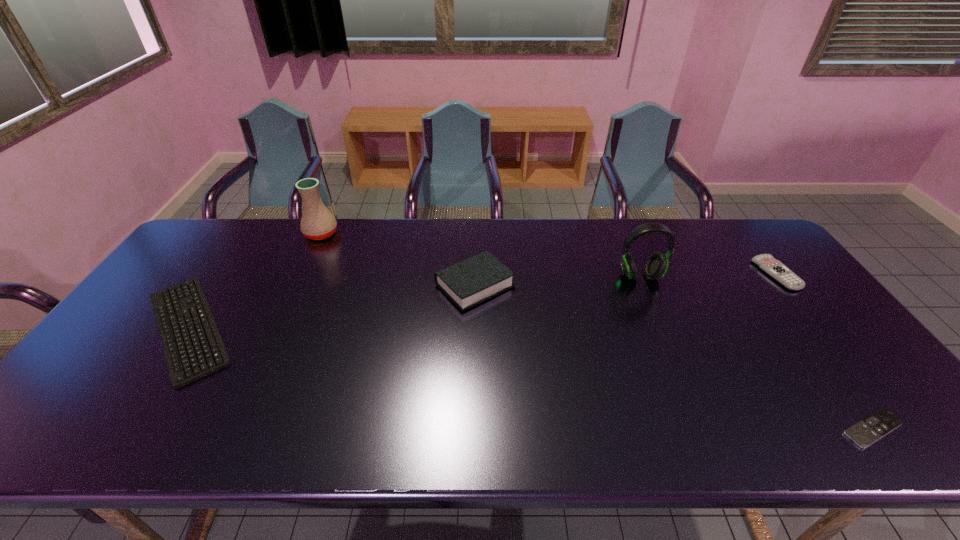
Where is `object located at the near right corner`? Image resolution: width=960 pixels, height=540 pixels. object located at the near right corner is located at coordinates (865, 432).

Where is `vacant region at the far edge of the desktop`? The height and width of the screenshot is (540, 960). vacant region at the far edge of the desktop is located at coordinates (521, 253).

Locate an element on the screen. The image size is (960, 540). free space at the left edge of the desktop is located at coordinates (160, 291).

In the image, there is a desktop. Where is `free space at the right edge`? free space at the right edge is located at coordinates click(x=846, y=375).

Where is `free space between the third object from right to left and the shorter remote control`? The height and width of the screenshot is (540, 960). free space between the third object from right to left and the shorter remote control is located at coordinates (756, 352).

Identify the location of free space that is in between the leftmost object and the nearest object. The height and width of the screenshot is (540, 960). (531, 378).

Locate an element on the screen. The image size is (960, 540). vacant region between the pottery and the fourth shortest object is located at coordinates (398, 260).

What are the coordinates of `free space between the pottery and the farther remote control` in the screenshot? It's located at (549, 254).

You are a GUI agent. You are given a task and a screenshot of the screen. Output one action in this format:
    pyautogui.click(x=<x>, y=<y>)
    Task: Click on the free area in between the fourth object from left to right and the computer keyboard
    
    Given the screenshot: What is the action you would take?
    pyautogui.click(x=414, y=302)

The height and width of the screenshot is (540, 960). I want to click on free space between the shortest object and the taller remote control, so click(825, 351).